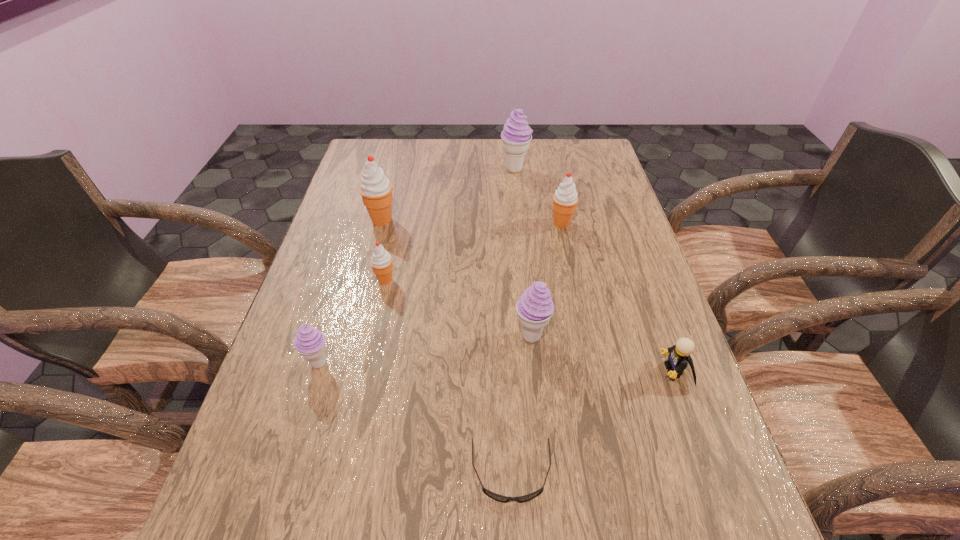
Locate an element on the screen. This screenshot has height=540, width=960. free spot between the farthest purple icecream and the biggest red icecream is located at coordinates (448, 194).

The image size is (960, 540). I want to click on free space between the fifth farthest icecream and the smallest purple icecream, so click(425, 349).

This screenshot has width=960, height=540. Find the location of `free point between the fifth nearest object and the biggest purple icecream`. free point between the fifth nearest object and the biggest purple icecream is located at coordinates (450, 225).

I want to click on vacant area that lies between the sunglasses and the rightmost icecream, so click(537, 348).

This screenshot has width=960, height=540. I want to click on free space between the second object from right to left and the biggest red icecream, so click(471, 221).

Image resolution: width=960 pixels, height=540 pixels. Identify the location of the seventh closest object to the fourth farthest object. (679, 354).

You are a GUI agent. You are given a task and a screenshot of the screen. Output one action in this format:
    pyautogui.click(x=<x>, y=<y>)
    Task: Click on the closest object relative to the Lego
    The width and height of the screenshot is (960, 540).
    Given the screenshot: What is the action you would take?
    pyautogui.click(x=535, y=307)

What are the coordinates of `the closest icecream to the sunglasses` in the screenshot? It's located at (535, 307).

Where is `the closest icecream to the seventh object from left to right`? The image size is (960, 540). the closest icecream to the seventh object from left to right is located at coordinates (516, 135).

Identify which purple icecream is the nearest to the Lego. Please provide its 2D coordinates. Your answer should be formatted as a tuple, i.e. [(x, y)], where the tuple contains the x and y coordinates of a point satisfying the conditions above.

[(535, 307)]